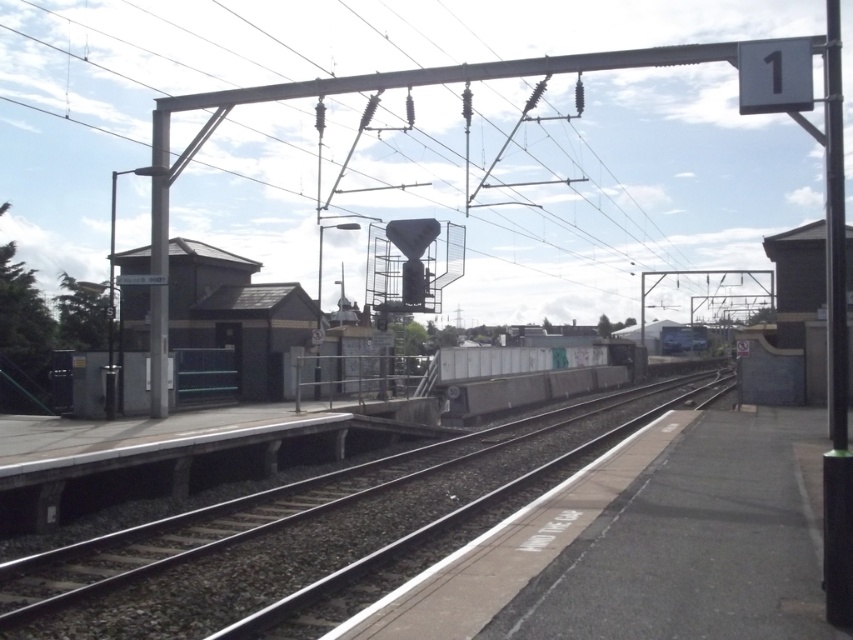
Question: Which point is farther to the camera?

Choices:
 (A) (161, 392)
 (B) (119, 618)

Answer: (A)

Question: Can you confirm if smooth concrete train track at center is positioned above black metal pole at right?

Choices:
 (A) no
 (B) yes

Answer: (A)

Question: Does black metal pole at right have a smaller size compared to metallic pole at left?

Choices:
 (A) no
 (B) yes

Answer: (A)

Question: Which is nearer to the silver metallic train at center?

Choices:
 (A) smooth concrete train track at center
 (B) black metal pole at right

Answer: (A)

Question: In this image, where is smooth concrete train track at center located relative to metallic pole at left?

Choices:
 (A) left
 (B) right

Answer: (B)

Question: Which of the following is the farthest from the observer?

Choices:
 (A) metallic pole at left
 (B) silver metallic train at center

Answer: (B)